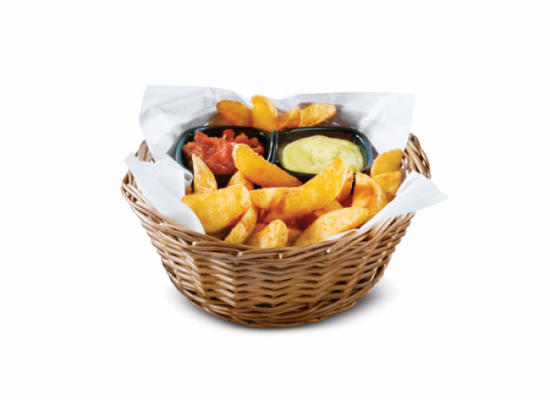
Where is `bottom edge of basket`? The image size is (550, 400). bottom edge of basket is located at coordinates (340, 313), (211, 320).